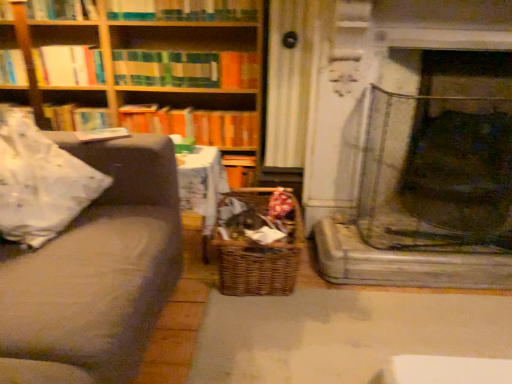
Find the location of `free space in front of woven brown basket at center`. free space in front of woven brown basket at center is located at coordinates click(x=274, y=333).